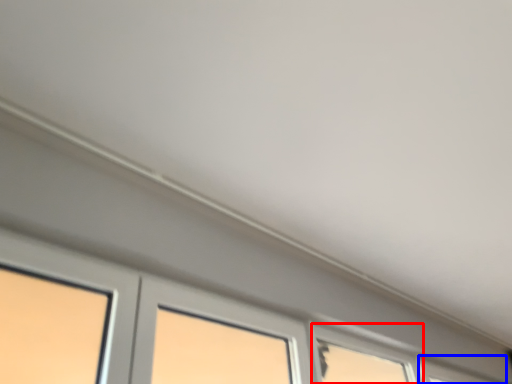
Question: Which of the following is the closest to the observer, window (highlighted by a red box) or window (highlighted by a blue box)?

Choices:
 (A) window
 (B) window

Answer: (A)